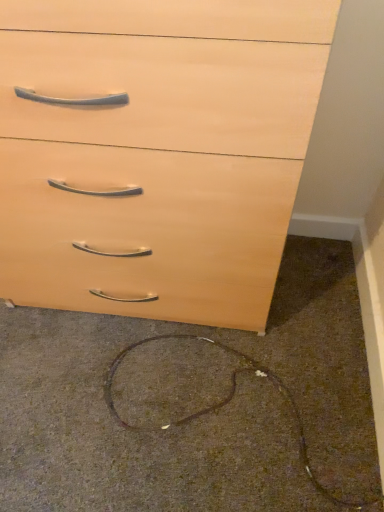
Question: Is light wood/finish chest of drawers at upper center to the left or to the right of brown matte wire at lower center in the image?

Choices:
 (A) right
 (B) left

Answer: (B)

Question: Do you think light wood/finish chest of drawers at upper center is within brown matte wire at lower center, or outside of it?

Choices:
 (A) outside
 (B) inside

Answer: (A)

Question: Considering the positions of light wood/finish chest of drawers at upper center and brown matte wire at lower center in the image, is light wood/finish chest of drawers at upper center bigger or smaller than brown matte wire at lower center?

Choices:
 (A) small
 (B) big

Answer: (B)

Question: In terms of height, does brown matte wire at lower center look taller or shorter compared to light wood/finish chest of drawers at upper center?

Choices:
 (A) tall
 (B) short

Answer: (B)

Question: Does point (210, 349) appear closer or farther from the camera than point (36, 259)?

Choices:
 (A) farther
 (B) closer

Answer: (A)

Question: From a real-world perspective, is brown matte wire at lower center physically located above or below light wood/finish chest of drawers at upper center?

Choices:
 (A) above
 (B) below

Answer: (B)

Question: Is brown matte wire at lower center bigger or smaller than light wood/finish chest of drawers at upper center?

Choices:
 (A) small
 (B) big

Answer: (A)